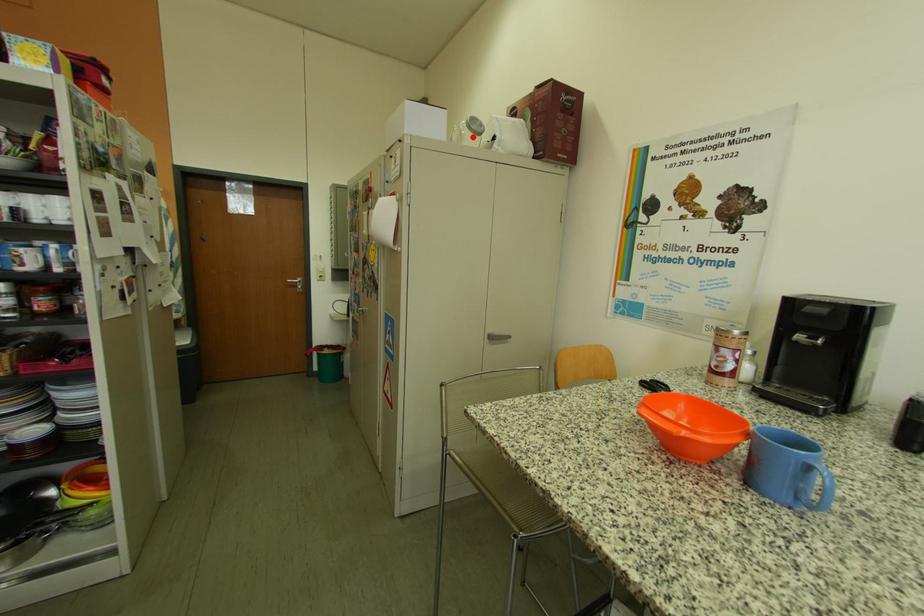
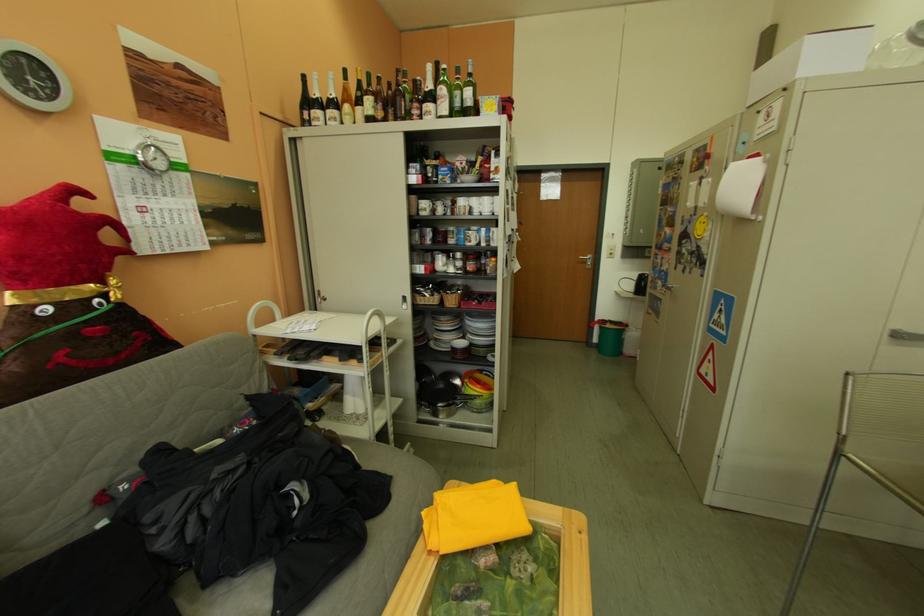
Question: I am providing you with two images of the same scene from different viewpoints. A red point is marked on the first image. Is the red point's position out of view in image 2?

Choices:
 (A) Yes
 (B) No

Answer: (B)